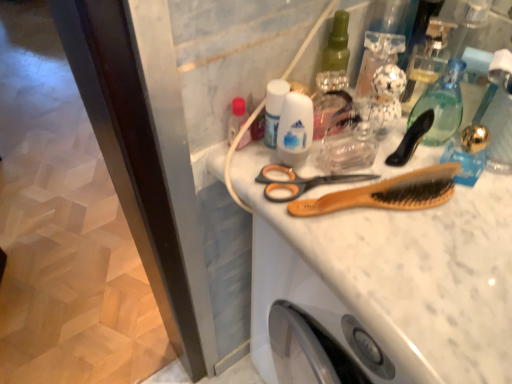
Image resolution: width=512 pixels, height=384 pixels. In order to click on unoccupied region to the right of matte plastic bottle at upper left, the first toiletry viewed from the left in this screenshot , I will do `click(370, 179)`.